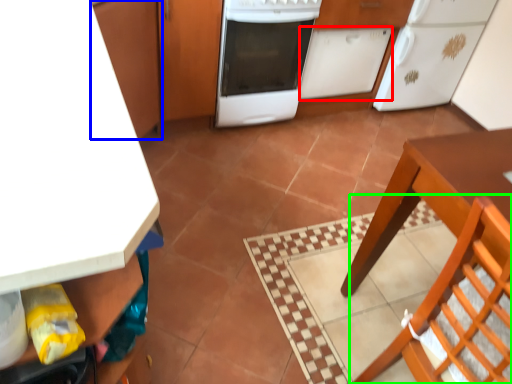
Question: Based on their relative distances, which object is nearer to cabinetry (highlighted by a red box)? Choose from cabinetry (highlighted by a blue box) and chair (highlighted by a green box).

Choices:
 (A) cabinetry
 (B) chair

Answer: (A)